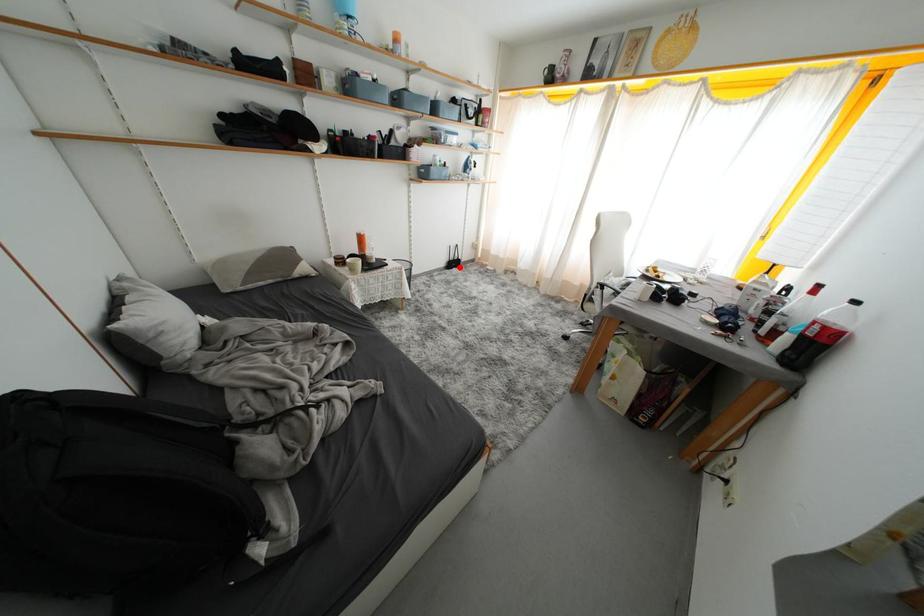
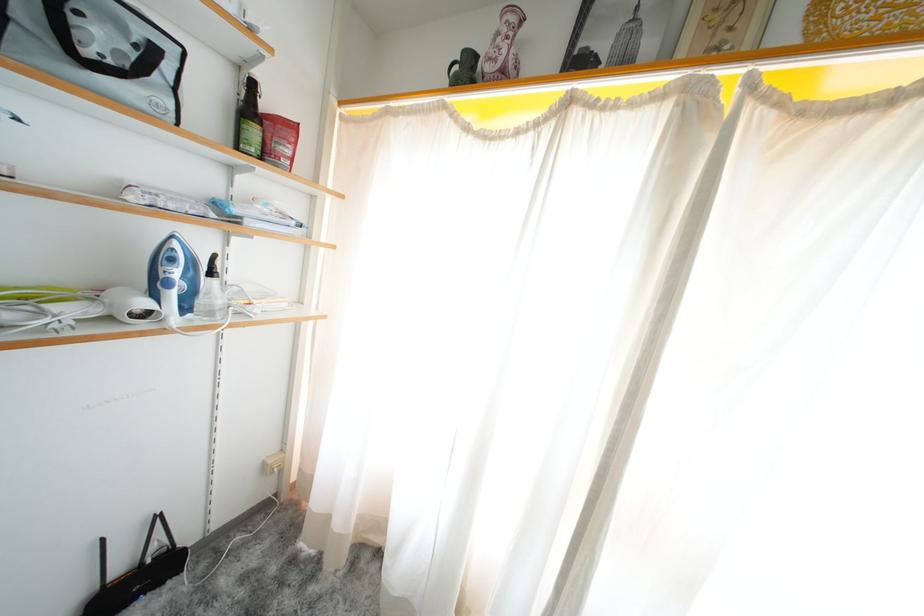
Question: I am providing you with two images of the same scene from different viewpoints. In image1, a red point is highlighted. Considering the same 3D point in image2, which of the following is correct?

Choices:
 (A) It is closer
 (B) It is farther

Answer: (A)